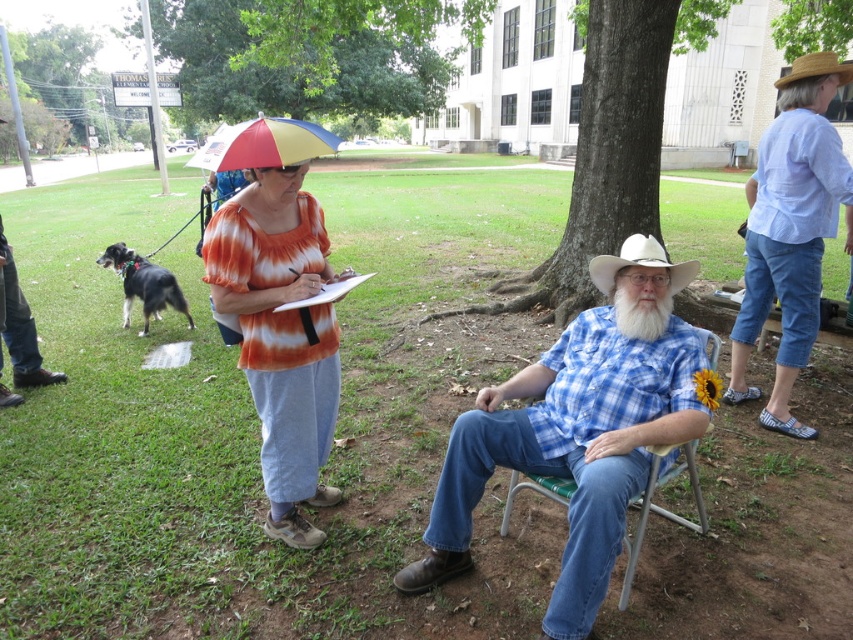
Is green leafy tree at upper center bigger than rainbow fabric umbrella at upper center?

Yes, green leafy tree at upper center is bigger than rainbow fabric umbrella at upper center.

Is point (309, 1) behind point (228, 160)?

Yes, it is.

Identify the location of green leafy tree at upper center. Image resolution: width=853 pixels, height=640 pixels. (311, 52).

Between metallic silver chair at lower center and white felt cowboy hat at center, which one is positioned higher?

Positioned higher is white felt cowboy hat at center.

Between point (631, 536) and point (659, 250), which one is positioned behind?

Positioned behind is point (631, 536).

Which is in front, point (695, 525) or point (619, 262)?

Point (619, 262) is in front.

Where is `metallic silver chair at lower center`? Image resolution: width=853 pixels, height=640 pixels. metallic silver chair at lower center is located at coordinates (659, 506).

Between green leafy tree at upper center and tie-dye fabric shirt at center, which one appears on the left side from the viewer's perspective?

green leafy tree at upper center is more to the left.

Can you confirm if green leafy tree at upper center is taller than tie-dye fabric shirt at center?

Correct, green leafy tree at upper center is much taller as tie-dye fabric shirt at center.

Who is more distant from viewer, (276,58) or (296,289)?

The point (276,58) is behind.

Locate an element on the screen. Image resolution: width=853 pixels, height=640 pixels. green leafy tree at upper center is located at coordinates (311, 52).